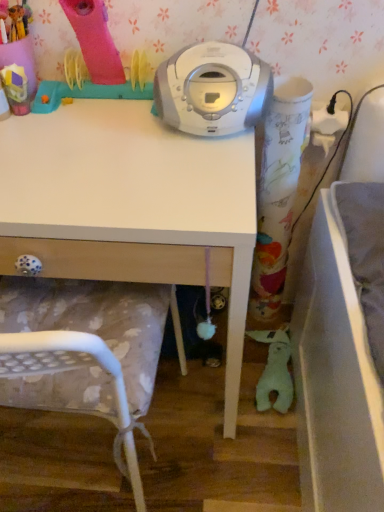
This screenshot has height=512, width=384. In order to click on vacant region in front of rubberized pink hairdryer at upper left, positioned as the 1th toy in top-to-bottom order in this screenshot , I will do `click(23, 155)`.